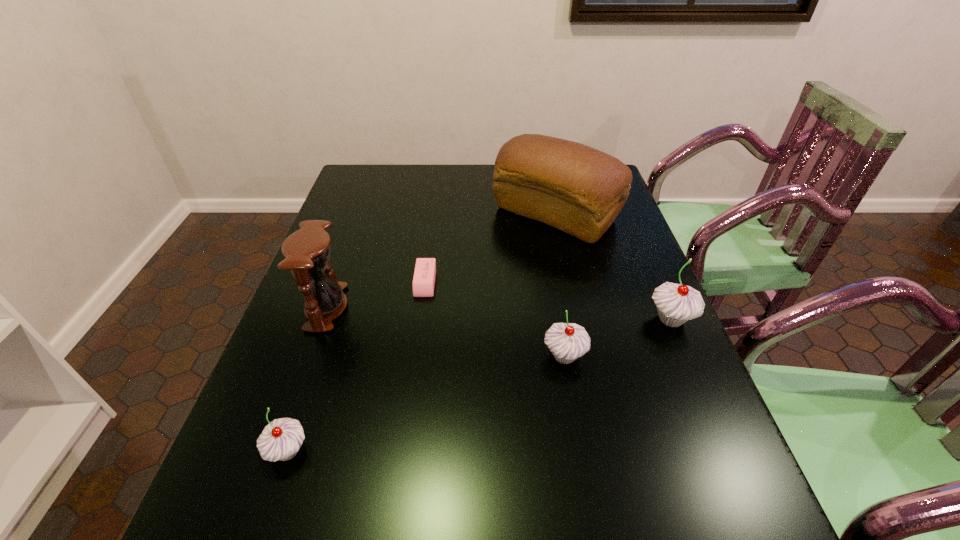
This screenshot has height=540, width=960. In order to click on bread that is at the right edge in this screenshot , I will do `click(575, 188)`.

Identify the location of object that is positioned at the near left corner. The image size is (960, 540). (281, 439).

Locate an element on the screen. The width and height of the screenshot is (960, 540). object that is at the far right corner is located at coordinates (575, 188).

Locate an element on the screen. The width and height of the screenshot is (960, 540). vacant space at the far edge of the desktop is located at coordinates (398, 184).

This screenshot has height=540, width=960. Find the location of `vacant space at the left edge of the desktop`. vacant space at the left edge of the desktop is located at coordinates (378, 204).

You are a GUI agent. You are given a task and a screenshot of the screen. Output one action in this format:
    pyautogui.click(x=<x>, y=<y>)
    Task: Click on the blank area at the right edge
    This screenshot has width=960, height=540.
    Given the screenshot: What is the action you would take?
    pyautogui.click(x=624, y=330)

You are a GUI agent. You are given a task and a screenshot of the screen. Output one action in this format:
    pyautogui.click(x=<x>, y=<y>)
    Task: Click on the vacant region at the far left corner of the desktop
    
    Given the screenshot: What is the action you would take?
    pyautogui.click(x=385, y=179)

This screenshot has height=540, width=960. I want to click on unoccupied area between the fifth farthest object and the shortest object, so coord(494,319).

Find the location of a particular element. This screenshot has height=540, width=960. vacant area that lies between the fifth shortest object and the bread is located at coordinates (441, 261).

Where is `unoccupied area between the farthest object and the hourglass`? The height and width of the screenshot is (540, 960). unoccupied area between the farthest object and the hourglass is located at coordinates (441, 261).